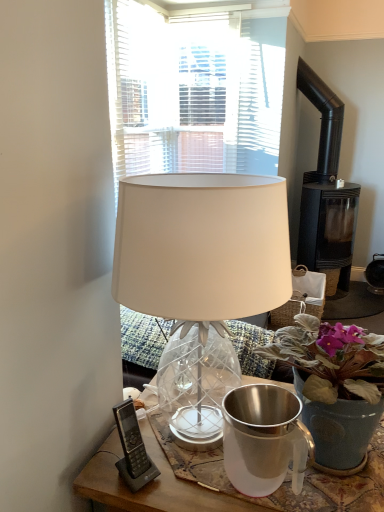
This screenshot has height=512, width=384. What do you see at coordinates (202, 245) in the screenshot?
I see `white glass lamp at center` at bounding box center [202, 245].

Identify the location of white glass lamp at center. The width and height of the screenshot is (384, 512). (202, 245).

What is the approximate height of shiny metallic jug at center?

It is 7.36 inches.

Identify the location of matte blue pot at center. (330, 415).

Do you think shiny metallic jug at center is within matte blue pot at center, or outside of it?

shiny metallic jug at center lies within the bounds of matte blue pot at center.

Measure the distance between shiny metallic jug at center and matte blue pot at center.

The distance of shiny metallic jug at center from matte blue pot at center is 10.32 centimeters.

Between shiny metallic jug at center and matte blue pot at center, which one has larger width?

With larger width is matte blue pot at center.

From the picture: Does shiny metallic jug at center have a lesser height compared to matte blue pot at center?

Indeed, shiny metallic jug at center has a lesser height compared to matte blue pot at center.

Can we say black plastic phone at lower left lies outside black matte fireplace at right?

black plastic phone at lower left is positioned outside black matte fireplace at right.

Does black plastic phone at lower left have a greater width compared to black matte fireplace at right?

No.

In the scene shown: From a real-world perspective, is black plastic phone at lower left located higher than black matte fireplace at right?

No.

Is point (143, 465) positioned before point (324, 149)?

Yes, point (143, 465) is closer to viewer.

From a real-world perspective, is white glass lamp at center physically located above or below black matte fireplace at right?

Clearly, from a real-world perspective, white glass lamp at center is above black matte fireplace at right.

Is white glass lamp at center facing towards black matte fireplace at right?

No.

Considering the sizes of white glass lamp at center and black matte fireplace at right in the image, is white glass lamp at center bigger or smaller than black matte fireplace at right?

In the image, white glass lamp at center appears to be smaller than black matte fireplace at right.

This screenshot has width=384, height=512. What are the coordinates of `fireplace that appears above the white glass lamp at center (from the image's perspective)` in the screenshot? It's located at (326, 190).

Is black plastic phone at lower left thinner than white glass lamp at center?

Correct, the width of black plastic phone at lower left is less than that of white glass lamp at center.

From the image's perspective, is black plastic phone at lower left under white glass lamp at center?

Correct, black plastic phone at lower left appears lower than white glass lamp at center in the image.

From a real-world perspective, is black plastic phone at lower left beneath matte blue pot at center?

Yes, from a real-world perspective, black plastic phone at lower left is beneath matte blue pot at center.

Which is less distant, (146, 452) or (349, 361)?

Point (146, 452).

From the image's perspective, who appears lower, black plastic phone at lower left or matte blue pot at center?

black plastic phone at lower left appears lower in the image.

From a real-world perspective, which is physically above, matte blue pot at center or black matte fireplace at right?

From a 3D spatial view, black matte fireplace at right is above.

Is the position of matte blue pot at center more distant than that of black matte fireplace at right?

No, matte blue pot at center is in front of black matte fireplace at right.

Can you tell me how much matte blue pot at center and black matte fireplace at right differ in facing direction?

The facing directions of matte blue pot at center and black matte fireplace at right are 1.34 degrees apart.

Based on the photo, is the surface of matte blue pot at center in direct contact with white glass lamp at center?

No.

Between matte blue pot at center and white glass lamp at center, which one has smaller width?

matte blue pot at center.

Is matte blue pot at center behind white glass lamp at center?

Yes.

The image size is (384, 512). What are the coordinates of `houseplant on the right of shiny metallic jug at center` in the screenshot? It's located at (330, 415).

Where is `fireplace behind the black plastic phone at lower left`? fireplace behind the black plastic phone at lower left is located at coordinates (326, 190).

Which object lies nearer to the anchor point matte blue pot at center, shiny metallic jug at center or white glass lamp at center?

The object closer to matte blue pot at center is shiny metallic jug at center.

Estimate the real-world distances between objects in this image. Which object is further from black plastic phone at lower left, shiny metallic jug at center or black matte fireplace at right?

A: black matte fireplace at right is further to black plastic phone at lower left.

Based on their spatial positions, is black matte fireplace at right or matte blue pot at center closer to shiny metallic jug at center?

matte blue pot at center is positioned closer to the anchor shiny metallic jug at center.

Considering their positions, is black plastic phone at lower left positioned closer to white glass lamp at center than shiny metallic jug at center?

shiny metallic jug at center lies closer to white glass lamp at center than the other object.

Considering their positions, is black matte fireplace at right positioned further to matte blue pot at center than white glass lamp at center?

Based on the image, black matte fireplace at right appears to be further to matte blue pot at center.

From the picture: Looking at the image, which one is located further to black matte fireplace at right, shiny metallic jug at center or matte blue pot at center?

shiny metallic jug at center lies further to black matte fireplace at right than the other object.

Considering their positions, is matte blue pot at center positioned further to black plastic phone at lower left than black matte fireplace at right?

Based on the image, black matte fireplace at right appears to be further to black plastic phone at lower left.

Based on their spatial positions, is matte blue pot at center or shiny metallic jug at center closer to black plastic phone at lower left?

shiny metallic jug at center is closer to black plastic phone at lower left.

The image size is (384, 512). Identify the location of lamp between black plastic phone at lower left and matte blue pot at center in the horizontal direction. (202, 245).

Where is `gadget between white glass lamp at center and black matte fireplace at right along the z-axis`? This screenshot has width=384, height=512. gadget between white glass lamp at center and black matte fireplace at right along the z-axis is located at coordinates (133, 449).

Locate an element on the screen. The width and height of the screenshot is (384, 512). jug between white glass lamp at center and black matte fireplace at right along the z-axis is located at coordinates (264, 439).

The height and width of the screenshot is (512, 384). In order to click on gadget between matte blue pot at center and black matte fireplace at right in the front-back direction in this screenshot , I will do [x=133, y=449].